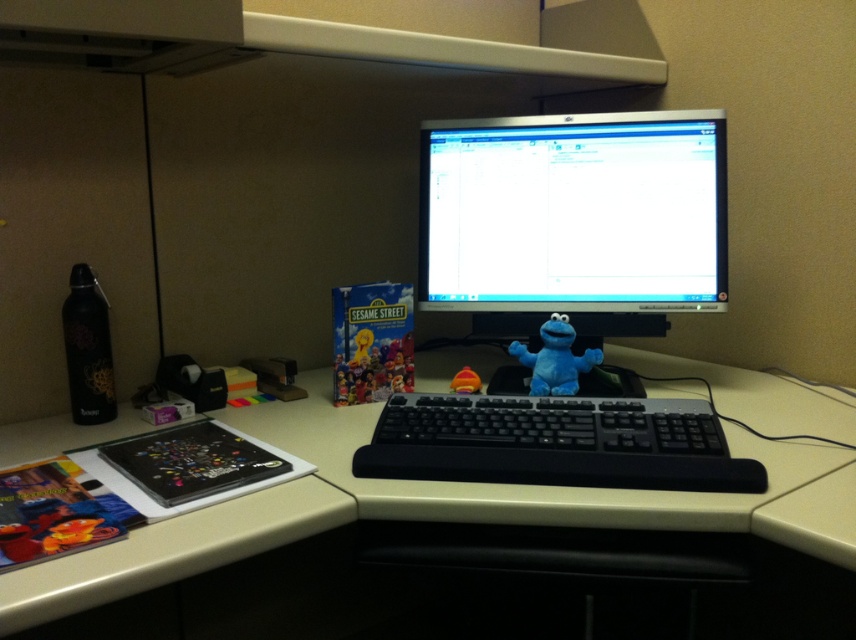
Is point (676, 170) farther from camera compared to point (565, 392)?

Yes, it is behind point (565, 392).

Can you confirm if matte black monitor at center is smaller than matte blue plush at center?

Actually, matte black monitor at center might be larger than matte blue plush at center.

Does point (583, 202) come closer to viewer compared to point (587, 358)?

No, it is not.

The height and width of the screenshot is (640, 856). I want to click on matte black monitor at center, so click(x=574, y=212).

Which is more to the left, beige plastic computer desk at center or black plastic keyboard at center?

beige plastic computer desk at center

Is beige plastic computer desk at center below black plastic keyboard at center?

Indeed, beige plastic computer desk at center is positioned under black plastic keyboard at center.

Between point (652, 388) and point (684, 436), which one is positioned in front?

Point (684, 436) is more forward.

The width and height of the screenshot is (856, 640). I want to click on beige plastic computer desk at center, so click(423, 509).

Describe the element at coordinates (423, 509) in the screenshot. Image resolution: width=856 pixels, height=640 pixels. I see `beige plastic computer desk at center` at that location.

Is point (195, 522) more distant than point (675, 259)?

No.

Where is `beige plastic computer desk at center`? The height and width of the screenshot is (640, 856). beige plastic computer desk at center is located at coordinates (x=423, y=509).